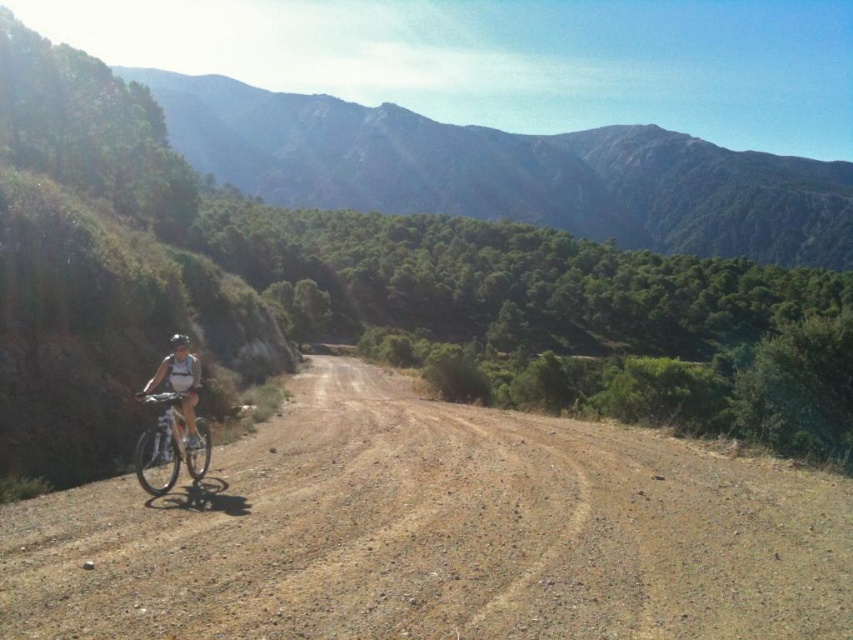
You are a cyclist planning to ride along the brown gravel dirt track at center while wearing the white matte helmet at center. Considering the width of the track and your helmet, do you think there is enough space for you to safely ride without touching the helmet on either side of the track?

The brown gravel dirt track at center is wider than the white matte helmet at center, so there is sufficient space for the cyclist to ride safely without the helmet touching the sides of the track.

You are a hiker who wants to reach the green forested mountain at upper center. According to the map, your current position is at point (511, 172). Which direction should you head towards?

The green forested mountain at upper center is located at point (511, 172), which matches your current position. You are already at the green forested mountain at upper center.

You are a hiker planning to take a photo of the green forested mountain at upper center from the dirt road where the cyclist is riding. Based on your current position on the road, which direction should you move to get the best view of the mountain?

Since the green forested mountain at upper center is located at coordinates point (x=511, y=172), you should move towards the upper center direction from your current position on the dirt road to get the best view of the mountain.